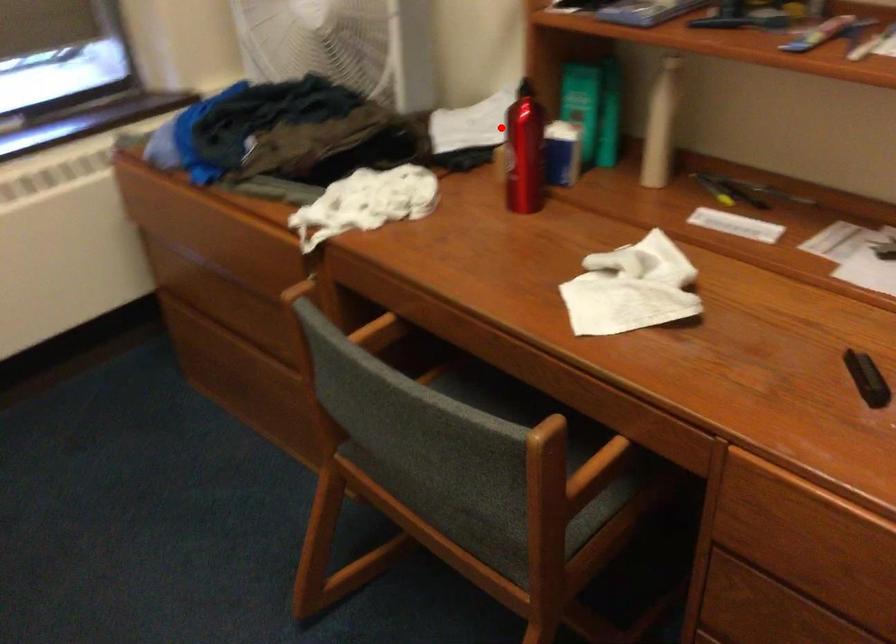
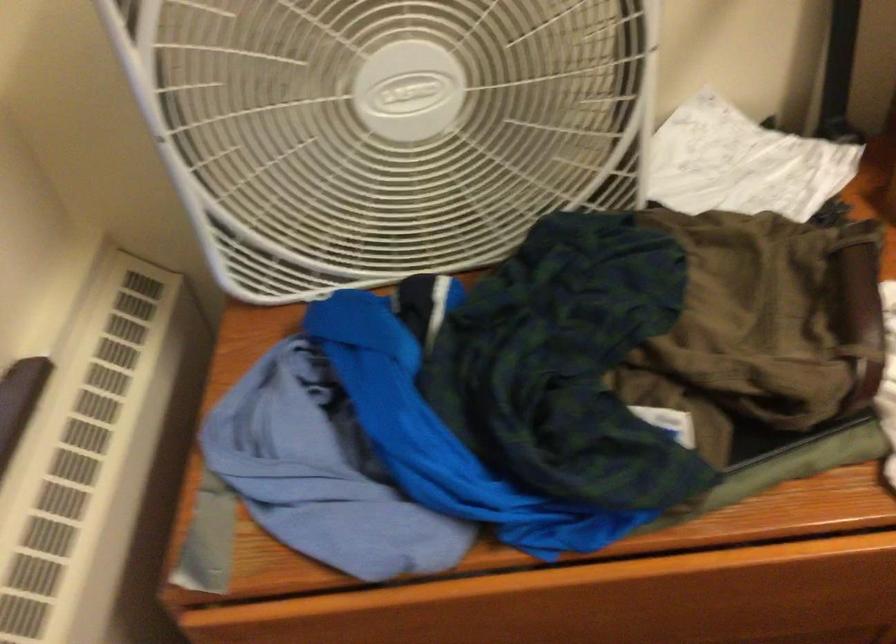
Question: I am providing you with two images of the same scene from different viewpoints. In image1, a red point is highlighted. Considering the same 3D point in image2, which of the following is correct?

Choices:
 (A) It is closer
 (B) It is farther

Answer: (A)